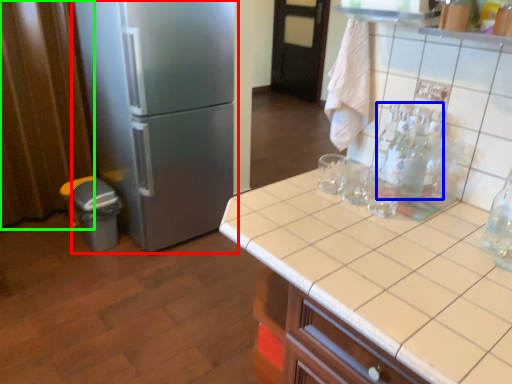
Question: Based on their relative distances, which object is farther from refrigerator (highlighted by a red box)? Choose from bottle (highlighted by a blue box) and curtain (highlighted by a green box).

Choices:
 (A) bottle
 (B) curtain

Answer: (A)